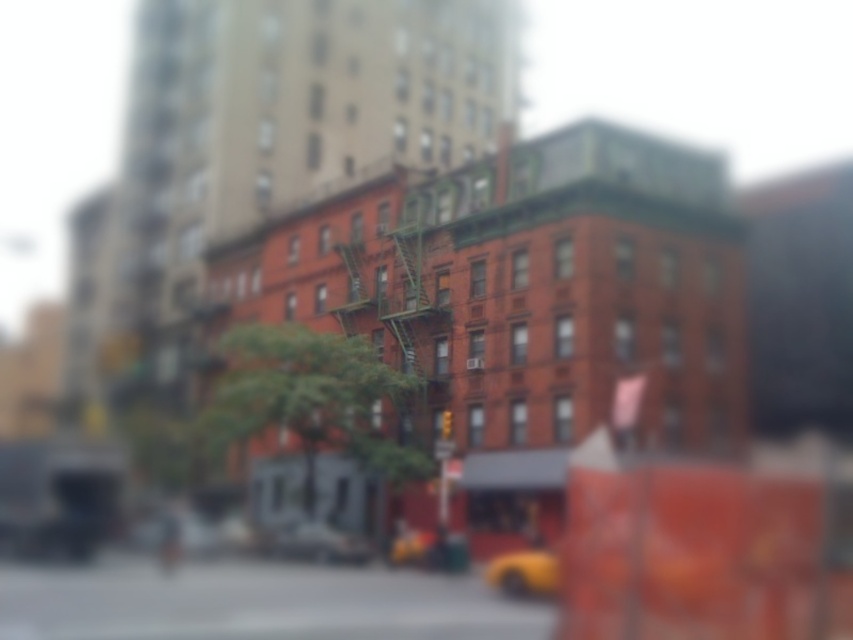
You are standing at the point marked as point [299,556] in the image. You want to take a photo of the red brick building with the green fire escape. Is the distance between you and the camera sufficient to capture the entire red brick building in the photo?

The distance between point [299,556] and the camera is 190.38 feet. Since the red brick building is in the foreground, it is likely within this distance and can be captured in the photo.

You are a delivery person needing to park your vehicle between two poles that are 2 meters apart. You have a yellow matte car at center and a yellow rubber taxi at lower center. Which vehicle can fit through the space?

The yellow rubber taxi at lower center can fit through the 2 meter space since its width is narrower than the yellow matte car at center, which is wider and may not fit.

You are a pedestrian standing on the sidewalk in this urban scene. You see a yellow matte car at center and a yellow rubber taxi at lower center. Which vehicle do you think is closer to you?

The yellow rubber taxi at lower center is closer to you since it is positioned at lower center, which typically indicates proximity in such scenes, whereas the yellow matte car at center might be further back despite its central placement.